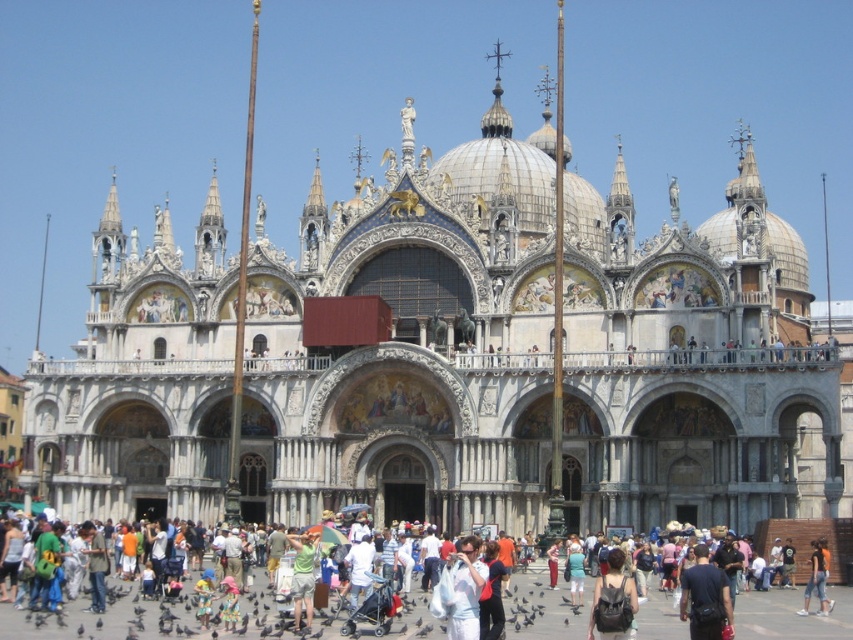
Does green cotton shirt at center appear on the left side of denim shorts at lower right?

Correct, you'll find green cotton shirt at center to the left of denim shorts at lower right.

Between green cotton shirt at center and denim shorts at lower right, which one appears on the left side from the viewer's perspective?

green cotton shirt at center

The height and width of the screenshot is (640, 853). What are the coordinates of `green cotton shirt at center` in the screenshot? It's located at (303, 576).

Does white cotton shirt at center have a greater height compared to denim shorts at lower right?

Yes, white cotton shirt at center is taller than denim shorts at lower right.

Can you confirm if white cotton shirt at center is smaller than denim shorts at lower right?

No, white cotton shirt at center is not smaller than denim shorts at lower right.

Which is behind, point (445, 570) or point (820, 572)?

Positioned behind is point (820, 572).

Find the location of `white cotton shirt at center`. white cotton shirt at center is located at coordinates (465, 589).

Can you confirm if white cotton shirt at center is thinner than green cotton shirt at center?

Yes.

Can you confirm if white cotton shirt at center is taller than green cotton shirt at center?

Indeed, white cotton shirt at center has a greater height compared to green cotton shirt at center.

I want to click on white cotton shirt at center, so click(x=465, y=589).

Where is `white cotton shirt at center`? This screenshot has height=640, width=853. white cotton shirt at center is located at coordinates (465, 589).